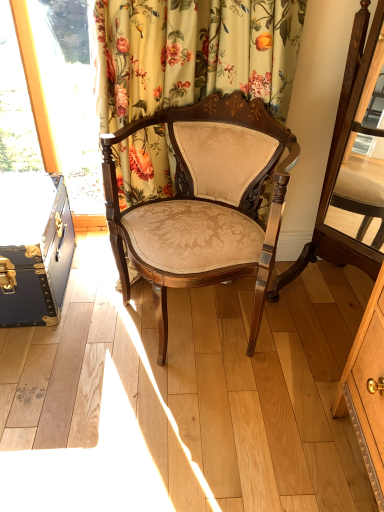
Question: Considering the relative positions of matte brown wood swivel chair at center and matte gold upholstery chair at center in the image provided, is matte brown wood swivel chair at center to the right of matte gold upholstery chair at center from the viewer's perspective?

Choices:
 (A) yes
 (B) no

Answer: (A)

Question: Is matte brown wood swivel chair at center facing towards matte gold upholstery chair at center?

Choices:
 (A) no
 (B) yes

Answer: (B)

Question: Considering the relative positions of matte brown wood swivel chair at center and matte gold upholstery chair at center in the image provided, is matte brown wood swivel chair at center in front of matte gold upholstery chair at center?

Choices:
 (A) no
 (B) yes

Answer: (B)

Question: Does matte brown wood swivel chair at center have a smaller size compared to matte gold upholstery chair at center?

Choices:
 (A) no
 (B) yes

Answer: (B)

Question: Is matte brown wood swivel chair at center taller than matte gold upholstery chair at center?

Choices:
 (A) yes
 (B) no

Answer: (A)

Question: Is matte brown wood swivel chair at center wider than matte gold upholstery chair at center?

Choices:
 (A) yes
 (B) no

Answer: (B)

Question: Is floral fabric curtain at upper center completely or partially outside of blue leather suitcase at left?

Choices:
 (A) yes
 (B) no

Answer: (A)

Question: Does floral fabric curtain at upper center have a smaller size compared to blue leather suitcase at left?

Choices:
 (A) no
 (B) yes

Answer: (A)

Question: Does floral fabric curtain at upper center appear on the right side of blue leather suitcase at left?

Choices:
 (A) yes
 (B) no

Answer: (A)

Question: Considering the relative sizes of floral fabric curtain at upper center and blue leather suitcase at left in the image provided, is floral fabric curtain at upper center thinner than blue leather suitcase at left?

Choices:
 (A) no
 (B) yes

Answer: (B)

Question: Is floral fabric curtain at upper center looking in the opposite direction of blue leather suitcase at left?

Choices:
 (A) no
 (B) yes

Answer: (A)

Question: From a real-world perspective, is floral fabric curtain at upper center on blue leather suitcase at left?

Choices:
 (A) no
 (B) yes

Answer: (B)

Question: Does blue leather suitcase at left appear on the right side of floral fabric curtain at upper center?

Choices:
 (A) yes
 (B) no

Answer: (B)